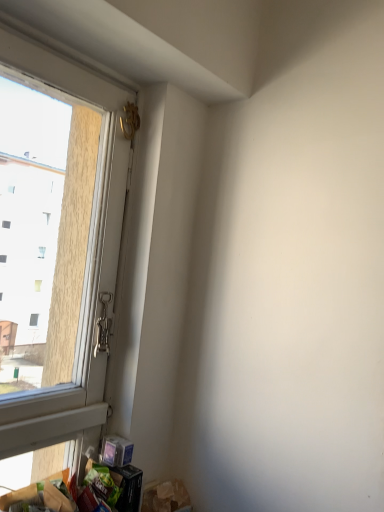
What is the approximate height of white plastic window at left?

Answer: The height of white plastic window at left is 3.69 feet.

What is the approximate width of white plastic window at left?

It is 3.25 inches.

Where is `white plastic window at left`? white plastic window at left is located at coordinates (85, 261).

Describe the element at coordinates (85, 261) in the screenshot. Image resolution: width=384 pixels, height=512 pixels. I see `white plastic window at left` at that location.

This screenshot has height=512, width=384. What are the coordinates of `white plastic window at left` in the screenshot? It's located at (85, 261).